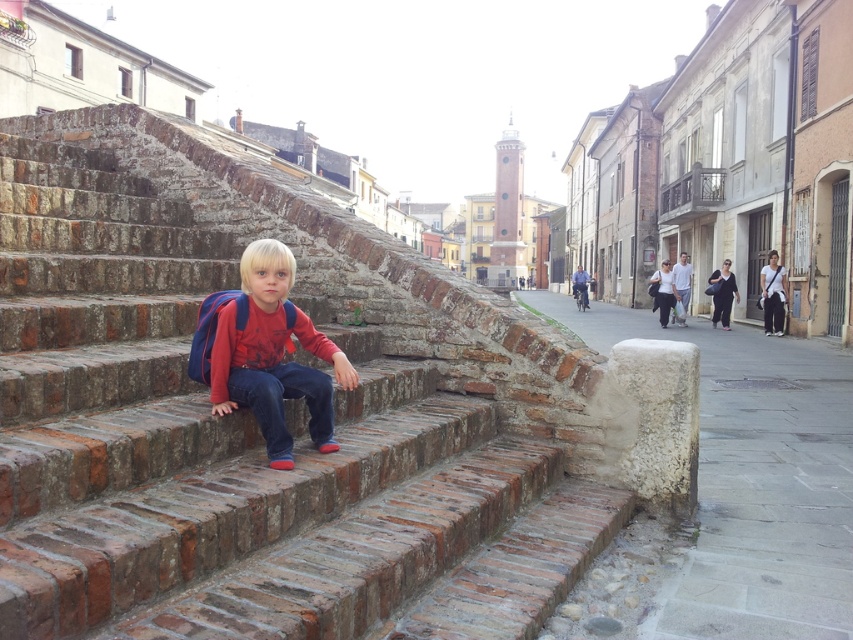
You are standing at the point closest to the child in the image. Which of the two points, point (337, 275) or point (286, 371), is farther away from you?

Point (337, 275) is farther away from you because it is behind point (286, 371).

You are a tourist in the historic town and want to take a photo of the brick stairs at center and the matte red shirt at center. From your current position, which object is lower in the image?

The brick stairs at center is below the matte red shirt at center, so the brick stairs at center is lower in the image.